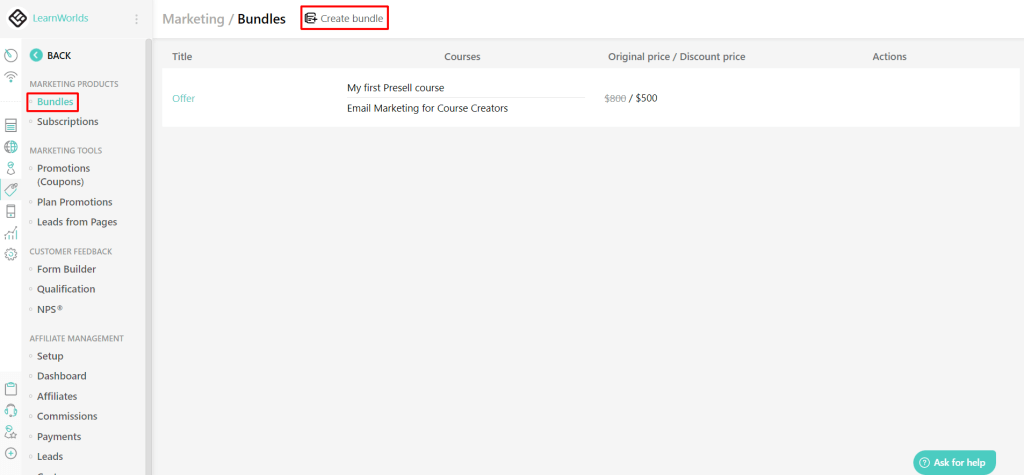
Identify the location of pictures. (22, 416).